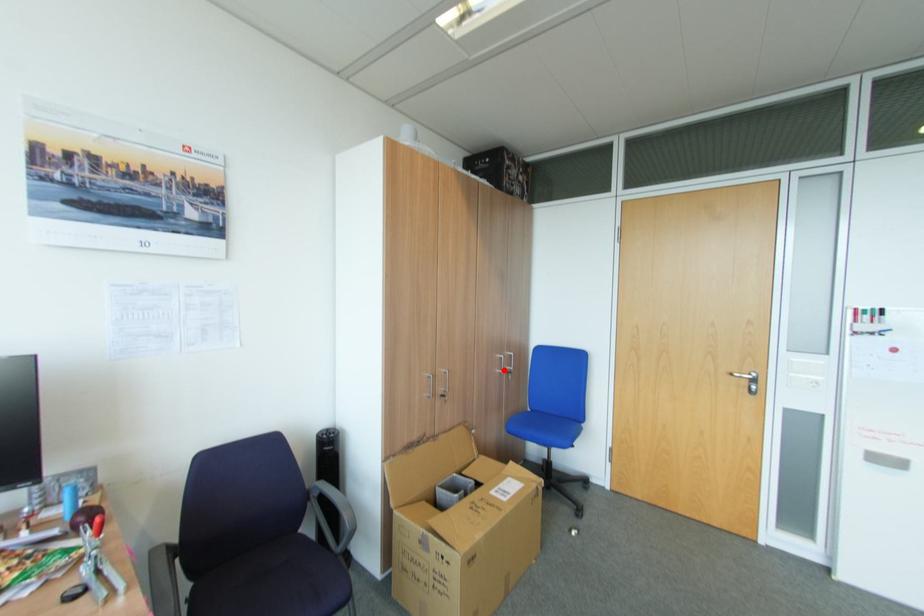
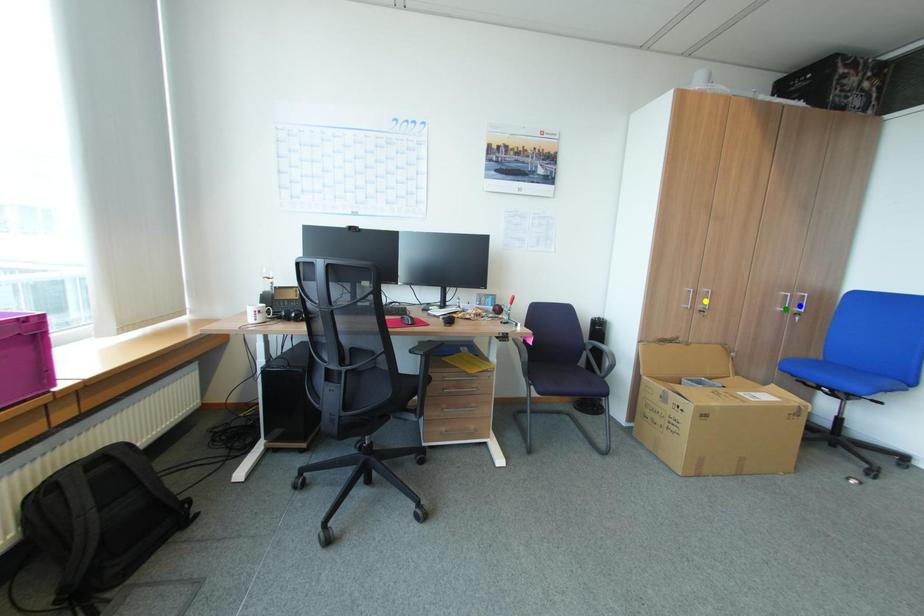
Question: I am providing you with two images of the same scene from different viewpoints. A red point is marked on the first image. You are given multiple points on the second image. Which point in image 2 represents the same 3d spot as the red point in image 1?

Choices:
 (A) yellow point
 (B) blue point
 (C) green point

Answer: (C)